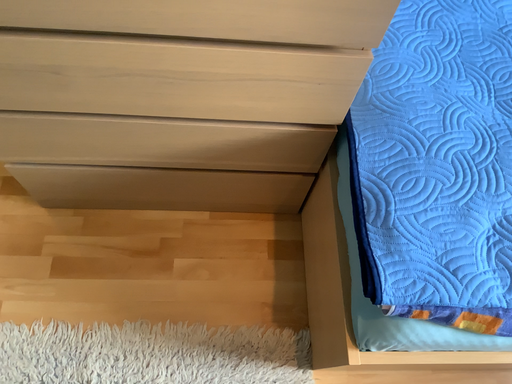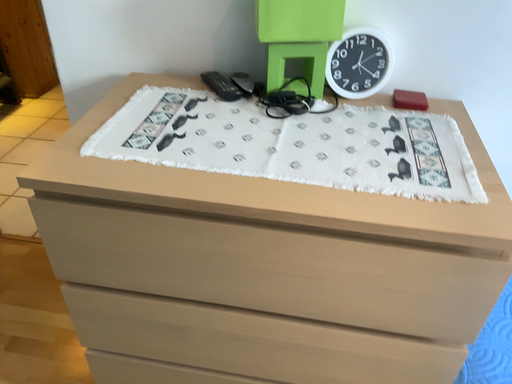
Question: Which way did the camera rotate in the video?

Choices:
 (A) rotated upward
 (B) rotated downward

Answer: (A)